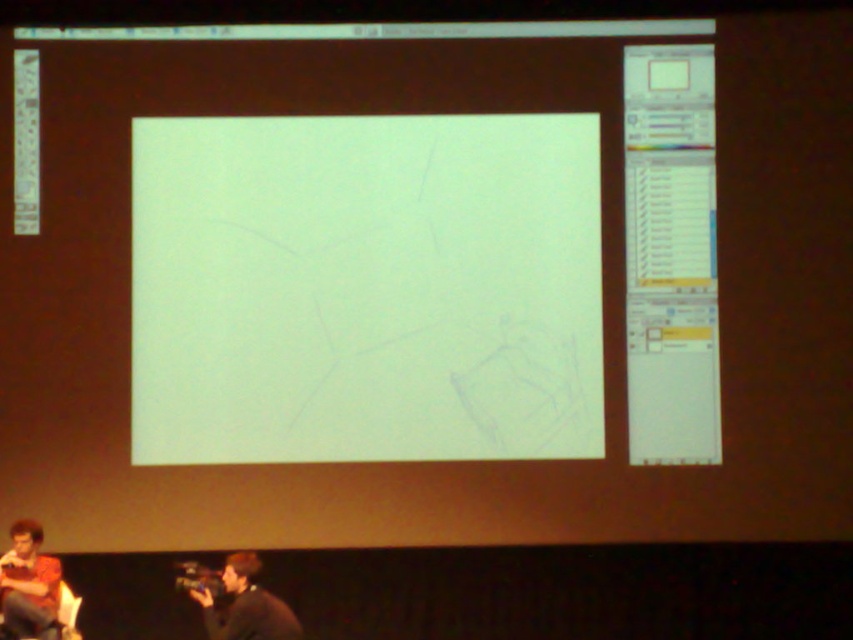
You are attending a virtual meeting and see the screen with the matte orange shirt at lower left and the dark gray sweater at lower center. Which participant is closer to the top of the screen?

The matte orange shirt at lower left is located above the dark gray sweater at lower center, so the participant in the matte orange shirt at lower left is closer to the top of the screen.

You are standing in front of the presentation screen and notice two points marked on the canvas. Which point is closer to the bottom edge of the screen? The points are labeled as point 1 at coordinates (9, 566) and point 2 at coordinates (254, 612). Please determine which one is closer to the bottom edge based on their coordinates.

Point 1 at coordinates (9, 566) is closer to the bottom edge of the screen because its y coordinate is 0.012, which is lower than point 2 at 0.300.

You are attending a virtual meeting where the screen shows a presentation. You need to determine if the white paper at center can be seen above the dark gray sweater at lower center. Can you confirm this?

The white paper at center is taller than the dark gray sweater at lower center, so yes, the white paper at center can be seen above the dark gray sweater at lower center.